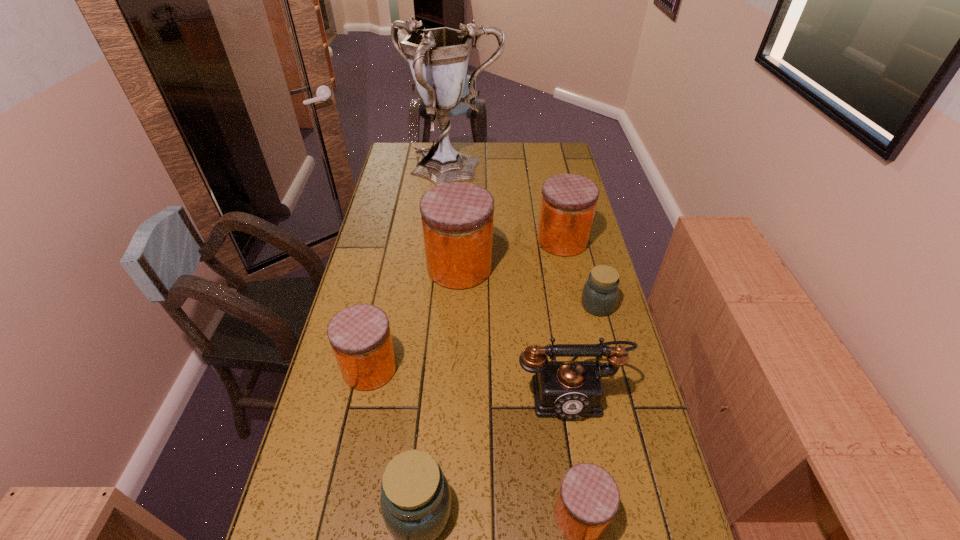
Find the location of a particular element. This screenshot has width=960, height=540. object that is at the far left corner is located at coordinates (438, 58).

This screenshot has height=540, width=960. In order to click on blank space at the far edge of the desktop in this screenshot , I will do `click(511, 152)`.

This screenshot has width=960, height=540. I want to click on vacant area at the left edge, so (311, 499).

What are the coordinates of `free spot at the far left corner of the desktop` in the screenshot? It's located at (404, 144).

Find the location of a particular element. The height and width of the screenshot is (540, 960). vacant space at the far right corner is located at coordinates (550, 154).

Locate an element on the screen. vacant space that is in between the tallest jar and the fifth shortest jar is located at coordinates (511, 254).

You are a GUI agent. You are given a task and a screenshot of the screen. Output one action in this format:
    pyautogui.click(x=<x>, y=<y>)
    Task: Click on the vacant space in between the tallest object and the second biggest orange jar
    Image resolution: width=960 pixels, height=540 pixels.
    Given the screenshot: What is the action you would take?
    pyautogui.click(x=507, y=206)

The image size is (960, 540). Find the location of `vacant space in between the third orange jar from right to left and the fifth shortest jar`. vacant space in between the third orange jar from right to left and the fifth shortest jar is located at coordinates (511, 254).

At what (x,y) coordinates should I click in order to perform the action: click on vacant space that is in between the biggest orange jar and the farther green jar. Please return your answer as a coordinate pair (x, y). The height and width of the screenshot is (540, 960). Looking at the image, I should click on (529, 286).

Identify the location of empty space between the second tallest object and the gray telephone. (515, 329).